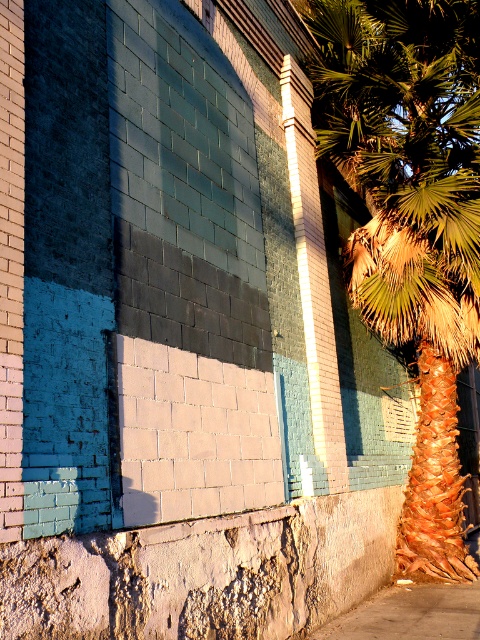
You are standing in front of the building and want to place a small potted plant on the gray concrete pavement at lower right. However, you notice the green leafy palm at right. Will the palm block sunlight from reaching the potted plant placed there?

The green leafy palm at right is positioned over gray concrete pavement at lower right, so it will cast a shadow on the pavement, potentially blocking sunlight from reaching the potted plant placed there.

You are standing in front of the building wall and want to determine which of the two points, point [388,163] or point [324,630], is closer to you. Based on the scene description, which point is nearer?

Point [388,163] is further to the viewer than point [324,630], so point [324,630] is closer to you.